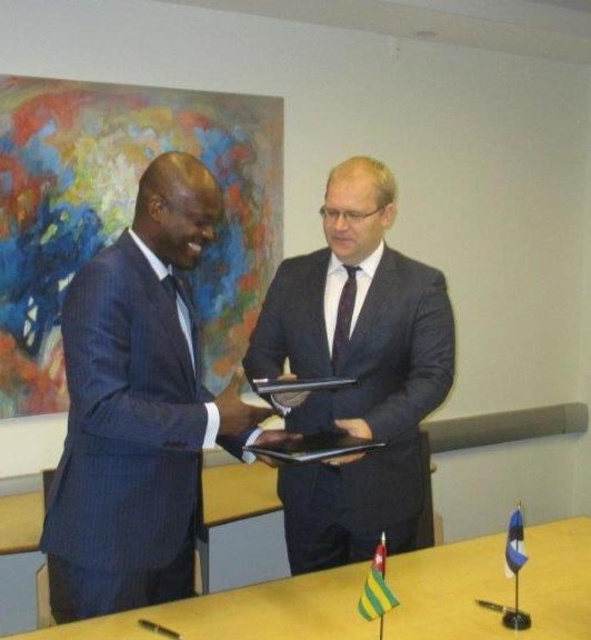
What are the coordinates of `blue pinstripe suit at left` in the screenshot? It's located at (138, 408).

Is point (70, 540) farther from viewer compared to point (358, 497)?

No, (70, 540) is closer to viewer.

The width and height of the screenshot is (591, 640). Describe the element at coordinates (138, 408) in the screenshot. I see `blue pinstripe suit at left` at that location.

Locate an element on the screen. Image resolution: width=591 pixels, height=640 pixels. blue pinstripe suit at left is located at coordinates (138, 408).

Does blue pinstripe suit at left have a lesser height compared to wooden table at center?

No.

Locate an element on the screen. blue pinstripe suit at left is located at coordinates [138, 408].

Is point (183, 541) less distant than point (527, 595)?

Yes, it is.

This screenshot has height=640, width=591. In order to click on blue pinstripe suit at left in this screenshot , I will do `click(138, 408)`.

You are a GUI agent. You are given a task and a screenshot of the screen. Output one action in this format:
    pyautogui.click(x=<x>, y=<y>)
    Task: Click on the dark blue suit at center
    This screenshot has width=591, height=640.
    Given the screenshot: What is the action you would take?
    pyautogui.click(x=356, y=372)

What do you see at coordinates (356, 372) in the screenshot? I see `dark blue suit at center` at bounding box center [356, 372].

Is point (358, 168) positioned in front of point (329, 625)?

No, it is not.

Locate an element on the screen. dark blue suit at center is located at coordinates pyautogui.click(x=356, y=372).